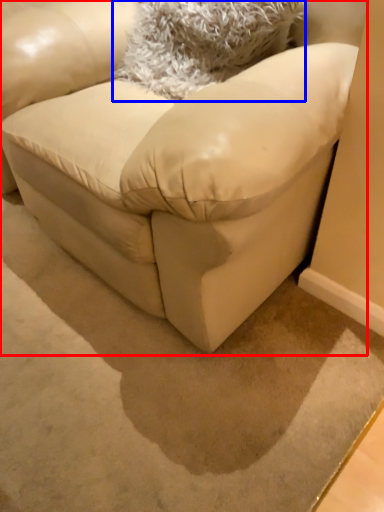
Question: Among these objects, which one is nearest to the camera, studio couch (highlighted by a red box) or throw pillow (highlighted by a blue box)?

Choices:
 (A) studio couch
 (B) throw pillow

Answer: (A)